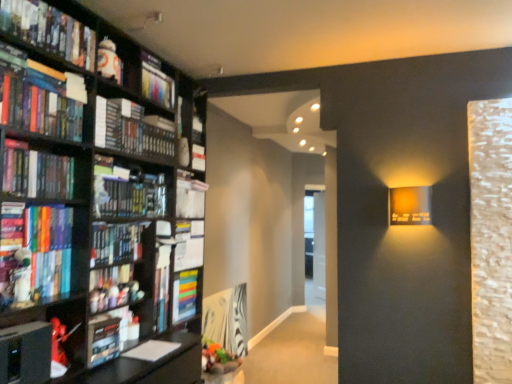
What do you see at coordinates (132, 130) in the screenshot? Image resolution: width=512 pixels, height=384 pixels. I see `hardcover book at left, the 6th book in the bottom-to-top sequence` at bounding box center [132, 130].

What are the coordinates of `hardcover book at upper left, the ninth book positioned from the bottom` in the screenshot? It's located at (50, 30).

Describe the element at coordinates (50, 30) in the screenshot. This screenshot has width=512, height=384. I see `hardcover book at upper left, the ninth book positioned from the bottom` at that location.

How much space does white matte bookshelf at upper left, the 5th book when ordered from bottom to top, occupy horizontally?

5.50 inches.

Find the location of a particular element. The height and width of the screenshot is (384, 512). matte white paper at lower left is located at coordinates (151, 350).

Locate an element on the screen. The image size is (512, 384). matte black book at left, the third book from the top is located at coordinates (36, 98).

Between matte black book at left, the third book from the top, and white glossy figurine at upper left, which one has larger size?

With larger size is matte black book at left, the third book from the top.

From a real-world perspective, which is physically below, matte black book at left, the third book from the top, or white glossy figurine at upper left?

matte black book at left, the third book from the top, is physically lower.

Which object is further away from the camera, matte black book at left, the seventh book from the bottom, or white glossy figurine at upper left?

white glossy figurine at upper left is behind.

Does matte black book at left, the third book from the top, have a greater height compared to white glossy figurine at upper left?

In fact, matte black book at left, the third book from the top, may be shorter than white glossy figurine at upper left.

From the image's perspective, relative to matte white paper at lower left, is hardcover book at left, the fourth book when ordered from top to bottom, above or below?

Based on their image positions, hardcover book at left, the fourth book when ordered from top to bottom, is located above matte white paper at lower left.

Who is shorter, hardcover book at left, the 6th book in the bottom-to-top sequence, or matte white paper at lower left?

With less height is matte white paper at lower left.

Looking at the image, does hardcover book at left, the 6th book in the bottom-to-top sequence, seem bigger or smaller compared to matte white paper at lower left?

Considering their sizes, hardcover book at left, the 6th book in the bottom-to-top sequence, takes up more space than matte white paper at lower left.

Is hardcover book at upper left, which ranks as the 1th book in top-to-bottom order, positioned before white matte bookshelf at upper left, the fifth book when ordered from top to bottom?

Yes, hardcover book at upper left, which ranks as the 1th book in top-to-bottom order, is closer to the viewer.

Starting from the hardcover book at upper left, the ninth book positioned from the bottom, which book is the 8th one behind? Please provide its 2D coordinates.

[(198, 158)]

What's the angular difference between hardcover book at upper left, which ranks as the 1th book in top-to-bottom order, and white matte bookshelf at upper left, the fifth book when ordered from top to bottom,'s facing directions?

1.72 degrees.

Is point (30, 7) positioned behind point (192, 163)?

No, it is not.

In the scene shown: Does matte white paper at lower left turn towards hardcover book at lower left, acting as the 9th book starting from the top?

No, matte white paper at lower left is not turned towards hardcover book at lower left, acting as the 9th book starting from the top.

From the image's perspective, is matte white paper at lower left located beneath hardcover book at lower left, marked as the 1th book in a bottom-to-top arrangement?

Yes, from the image's perspective, matte white paper at lower left is below hardcover book at lower left, marked as the 1th book in a bottom-to-top arrangement.

Is matte white paper at lower left behind hardcover book at lower left, marked as the 1th book in a bottom-to-top arrangement?

Yes, matte white paper at lower left is further from the viewer.

Do you think white matte bookshelf at upper left, the fifth book when ordered from top to bottom, is within multicolored plastic book at center, the second book when ordered from bottom to top, or outside of it?

The correct answer is: outside.

Considering the sizes of white matte bookshelf at upper left, the fifth book when ordered from top to bottom, and multicolored plastic book at center, the eighth book when ordered from top to bottom, in the image, is white matte bookshelf at upper left, the fifth book when ordered from top to bottom, wider or thinner than multicolored plastic book at center, the eighth book when ordered from top to bottom,?

Clearly, white matte bookshelf at upper left, the fifth book when ordered from top to bottom, has less width compared to multicolored plastic book at center, the eighth book when ordered from top to bottom.

Which object is closer to the camera, white matte bookshelf at upper left, the 5th book when ordered from bottom to top, or multicolored plastic book at center, the eighth book when ordered from top to bottom?

multicolored plastic book at center, the eighth book when ordered from top to bottom, is closer to the camera.

Where is `the 1st book counting from the left side of the white matte bookshelf at upper left, the fifth book when ordered from top to bottom`? the 1st book counting from the left side of the white matte bookshelf at upper left, the fifth book when ordered from top to bottom is located at coordinates (185, 295).

Looking at this image, from a real-world perspective, does hardcover book at lower left, acting as the 9th book starting from the top, sit lower than white matte bookshelf at upper left, the fifth book when ordered from top to bottom?

Yes, from a real-world perspective, hardcover book at lower left, acting as the 9th book starting from the top, is below white matte bookshelf at upper left, the fifth book when ordered from top to bottom.

Considering the points (130, 337) and (197, 162), which point is behind, point (130, 337) or point (197, 162)?

The point (197, 162) is farther.

In the scene shown: Is hardcover book at lower left, marked as the 1th book in a bottom-to-top arrangement, oriented towards white matte bookshelf at upper left, the fifth book when ordered from top to bottom?

No, hardcover book at lower left, marked as the 1th book in a bottom-to-top arrangement, is not turned towards white matte bookshelf at upper left, the fifth book when ordered from top to bottom.

In the scene shown: Can you confirm if hardcover book at lower left, acting as the 9th book starting from the top, is taller than white matte bookshelf at upper left, the 5th book when ordered from bottom to top?

Yes.

Considering the sizes of matte white paper at lower left and hardcover book at upper left, which ranks as the 1th book in top-to-bottom order, in the image, is matte white paper at lower left bigger or smaller than hardcover book at upper left, which ranks as the 1th book in top-to-bottom order,?

matte white paper at lower left is smaller than hardcover book at upper left, which ranks as the 1th book in top-to-bottom order.

Between point (131, 350) and point (76, 52), which one is positioned behind?

The point (131, 350) is farther.

Is matte white paper at lower left thinner than hardcover book at upper left, which ranks as the 1th book in top-to-bottom order?

In fact, matte white paper at lower left might be wider than hardcover book at upper left, which ranks as the 1th book in top-to-bottom order.

Is matte white paper at lower left taller or shorter than hardcover book at upper left, the ninth book positioned from the bottom?

Considering their sizes, matte white paper at lower left has less height than hardcover book at upper left, the ninth book positioned from the bottom.

I want to click on shelf behind the matte black book at left, the third book from the top, so click(118, 59).

What are the coordinates of `the 2nd book to the left when counting from the matte white paper at lower left` in the screenshot? It's located at (132, 130).

Consider the image. Estimate the real-world distances between objects in this image. Which object is closer to multicolored plastic book at center, the second book when ordered from bottom to top, hardcover book at left, the third book from the bottom, or matte white paper at lower left?

matte white paper at lower left is closer to multicolored plastic book at center, the second book when ordered from bottom to top.

When comparing their distances from matte white paper at lower left, does matte black book at left, the seventh book from the bottom, or multicolored plastic book at center, the second book when ordered from bottom to top, seem closer?

The object closer to matte white paper at lower left is multicolored plastic book at center, the second book when ordered from bottom to top.

Which object lies nearer to the anchor point matte white paper at lower left, multicolored plastic book at center, the eighth book when ordered from top to bottom, or white matte bookshelf at upper left, the fifth book when ordered from top to bottom?

The object closer to matte white paper at lower left is multicolored plastic book at center, the eighth book when ordered from top to bottom.

Consider the image. Looking at the image, which one is located further to multicolored plastic book at center, the second book when ordered from bottom to top, matte plastic book at upper left, the 8th book when ordered from bottom to top, or matte black book at left, the third book from the top?

matte black book at left, the third book from the top.

Considering their positions, is matte white paper at lower left positioned closer to matte black book at left, the seventh book from the bottom, than hardcover book at upper left, which ranks as the 1th book in top-to-bottom order?

hardcover book at upper left, which ranks as the 1th book in top-to-bottom order, lies closer to matte black book at left, the seventh book from the bottom, than the other object.

Consider the image. Considering their positions, is matte black book at left, the third book from the top, positioned closer to hardcover book at lower left, marked as the 1th book in a bottom-to-top arrangement, than hardcover book at upper left, which ranks as the 1th book in top-to-bottom order?

The object closer to hardcover book at lower left, marked as the 1th book in a bottom-to-top arrangement, is matte black book at left, the third book from the top.

From the image, which object appears to be farther from white glossy figurine at upper left, matte white paper at lower left or multicolored plastic book at center, the second book when ordered from bottom to top?

matte white paper at lower left is further to white glossy figurine at upper left.

From the image, which object appears to be nearer to white glossy figurine at upper left, hardcover book at upper left, which ranks as the 1th book in top-to-bottom order, or hardcover book at left, arranged as the 7th book when viewed from the top?

hardcover book at upper left, which ranks as the 1th book in top-to-bottom order, is closer to white glossy figurine at upper left.

Image resolution: width=512 pixels, height=384 pixels. I want to click on shelf positioned between hardcover book at left, arranged as the 7th book when viewed from the top, and white matte bookshelf at upper left, the fifth book when ordered from top to bottom, from near to far, so click(118, 59).

This screenshot has width=512, height=384. In order to click on paperback book located between hardcover book at left, arranged as the 7th book when viewed from the top, and multicolored plastic book at center, the second book when ordered from bottom to top, in the depth direction in this screenshot , I will do `click(151, 350)`.

I want to click on paperback book located between matte black book at left, the third book from the top, and white matte bookshelf at upper left, the fifth book when ordered from top to bottom, in the depth direction, so click(x=151, y=350).

You are a GUI agent. You are given a task and a screenshot of the screen. Output one action in this format:
    pyautogui.click(x=<x>, y=<y>)
    Task: Click on the shelf between hardcover book at upper left, which ranks as the 1th book in top-to-bottom order, and matte white paper at lower left vertically
    This screenshot has height=384, width=512.
    Given the screenshot: What is the action you would take?
    pyautogui.click(x=118, y=59)